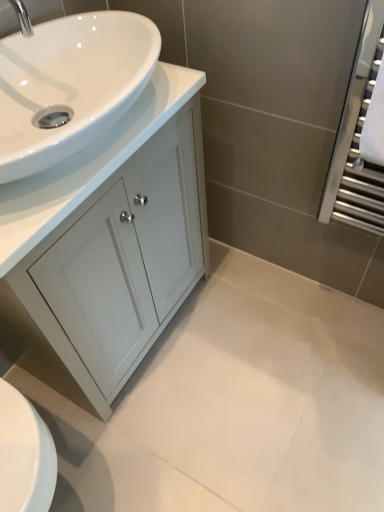
Question: From a real-world perspective, does white glossy cabinet at left sit lower than silver metallic tap at upper left?

Choices:
 (A) no
 (B) yes

Answer: (B)

Question: Is white glossy cabinet at left far away from silver metallic tap at upper left?

Choices:
 (A) no
 (B) yes

Answer: (A)

Question: Is white glossy cabinet at left at the left side of silver metallic tap at upper left?

Choices:
 (A) no
 (B) yes

Answer: (A)

Question: Is white glossy cabinet at left aimed at silver metallic tap at upper left?

Choices:
 (A) yes
 (B) no

Answer: (B)

Question: Is white glossy cabinet at left completely or partially outside of silver metallic tap at upper left?

Choices:
 (A) yes
 (B) no

Answer: (A)

Question: From a real-world perspective, is white glossy sink at upper left above or below white glossy cabinet at left?

Choices:
 (A) above
 (B) below

Answer: (A)

Question: In the image, is white glossy sink at upper left on the left side or the right side of white glossy cabinet at left?

Choices:
 (A) right
 (B) left

Answer: (B)

Question: From the image's perspective, relative to white glossy cabinet at left, is white glossy sink at upper left above or below?

Choices:
 (A) above
 (B) below

Answer: (A)

Question: Is white glossy sink at upper left bigger or smaller than white glossy cabinet at left?

Choices:
 (A) big
 (B) small

Answer: (B)

Question: Is silver metallic tap at upper left wider or thinner than white glossy sink at upper left?

Choices:
 (A) wide
 (B) thin

Answer: (B)

Question: From a real-world perspective, is silver metallic tap at upper left above or below white glossy sink at upper left?

Choices:
 (A) above
 (B) below

Answer: (A)

Question: Is silver metallic tap at upper left to the left or to the right of white glossy sink at upper left in the image?

Choices:
 (A) left
 (B) right

Answer: (A)

Question: Based on their sizes in the image, would you say silver metallic tap at upper left is bigger or smaller than white glossy sink at upper left?

Choices:
 (A) small
 (B) big

Answer: (A)

Question: In the image, is silver metallic tap at upper left on the left side or the right side of white glossy cabinet at left?

Choices:
 (A) right
 (B) left

Answer: (B)

Question: Considering their positions, is silver metallic tap at upper left located in front of or behind white glossy cabinet at left?

Choices:
 (A) front
 (B) behind

Answer: (A)